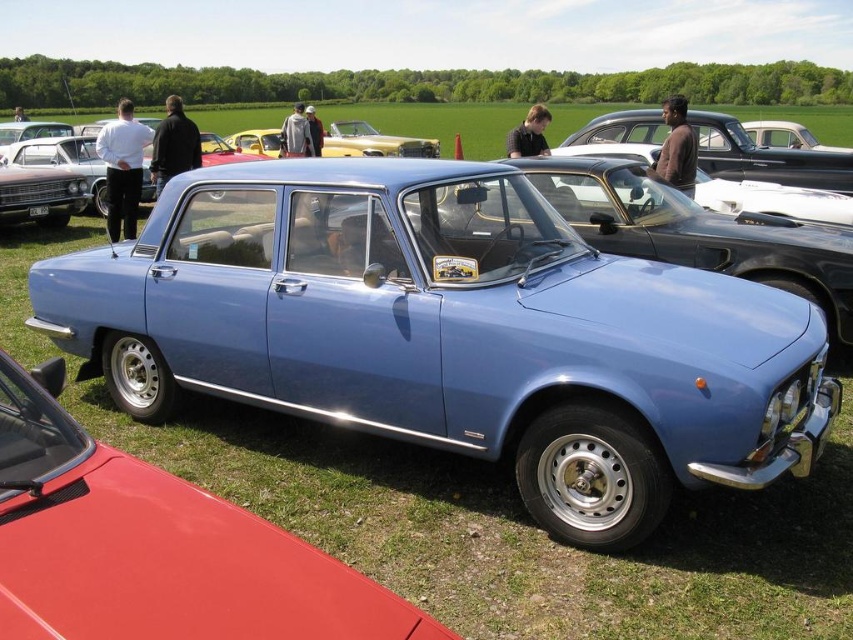
Is matte blue car at center smaller than metallic blue sedan at center?

Actually, matte blue car at center might be larger than metallic blue sedan at center.

What do you see at coordinates (450, 332) in the screenshot?
I see `matte blue car at center` at bounding box center [450, 332].

The height and width of the screenshot is (640, 853). What do you see at coordinates (450, 332) in the screenshot?
I see `matte blue car at center` at bounding box center [450, 332].

You are a GUI agent. You are given a task and a screenshot of the screen. Output one action in this format:
    pyautogui.click(x=<x>, y=<y>)
    Task: Click on the matte blue car at center
    This screenshot has width=853, height=640.
    Given the screenshot: What is the action you would take?
    pyautogui.click(x=450, y=332)

In the scene shown: Who is lower down, matte blue car at center or matte blue sedan at center?

Positioned lower is matte blue car at center.

Between point (436, 275) and point (822, 154), which one is positioned behind?

Positioned behind is point (822, 154).

Where is `matte blue car at center`? The image size is (853, 640). matte blue car at center is located at coordinates (450, 332).

Which is above, metallic blue sedan at center or matte blue sedan at center?

matte blue sedan at center is above.

Who is shorter, metallic blue sedan at center or matte blue sedan at center?

Standing shorter between the two is metallic blue sedan at center.

Locate an element on the screen. metallic blue sedan at center is located at coordinates (154, 547).